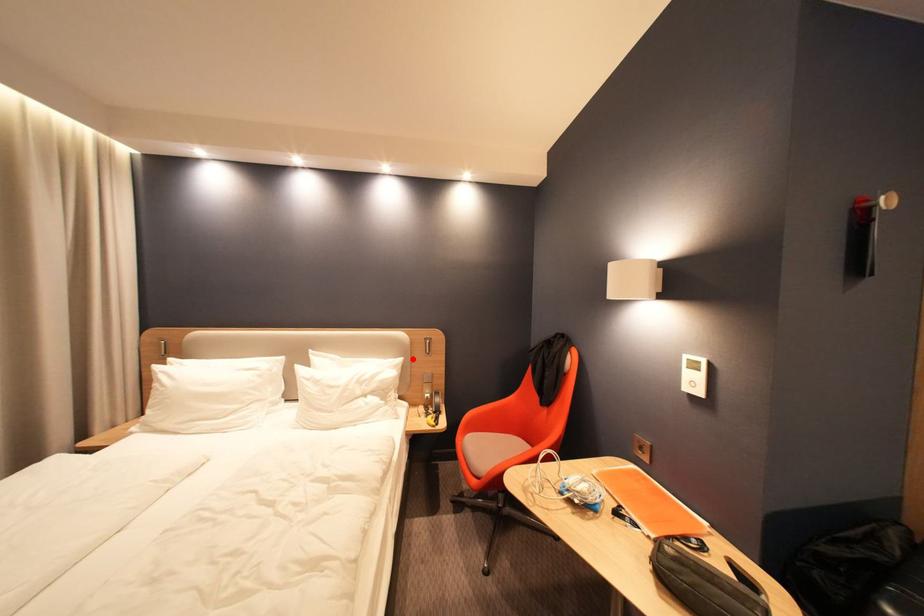
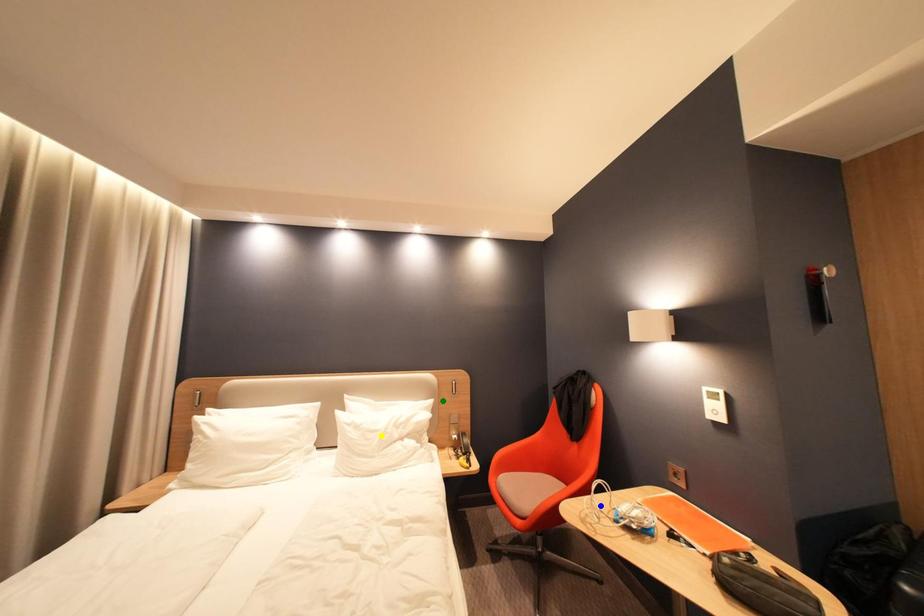
Question: I am providing you with two images of the same scene from different viewpoints. A red point is marked on the first image. You are given multiple points on the second image. Can you choose the point in image 2 that corresponds to the point in image 1?

Choices:
 (A) green point
 (B) blue point
 (C) yellow point

Answer: (A)